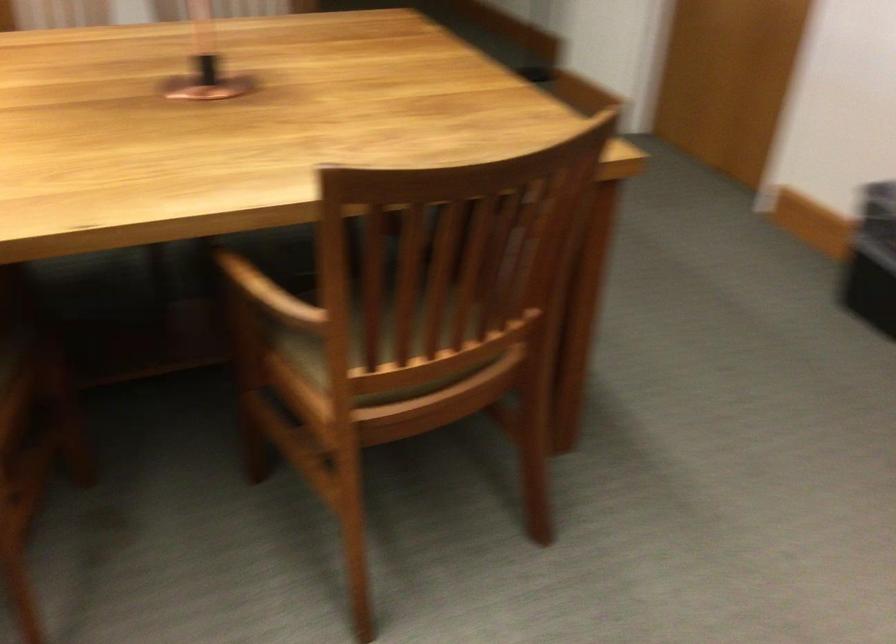
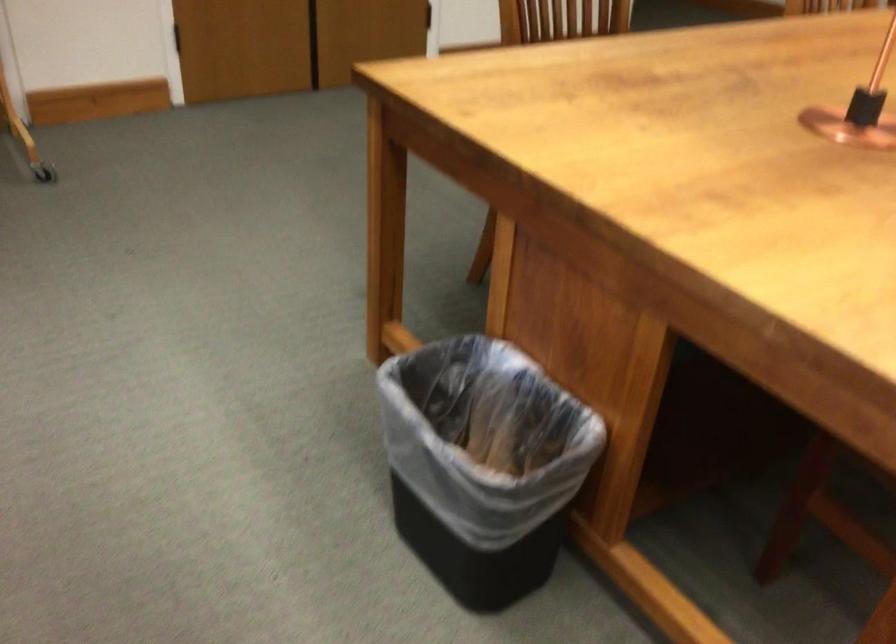
Question: What movement of the cameraman would produce the second image?

Choices:
 (A) Left
 (B) Right
 (C) Forward
 (D) Backward

Answer: (A)